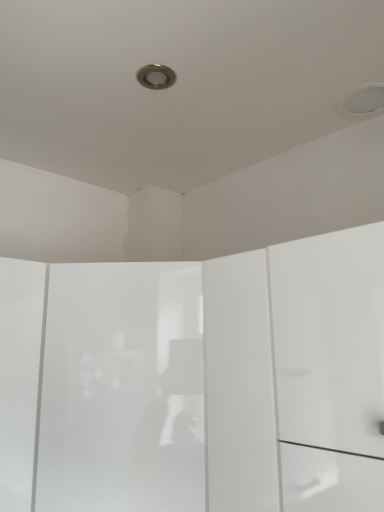
Image resolution: width=384 pixels, height=512 pixels. Find the location of `transparent glossy screen door at center`. transparent glossy screen door at center is located at coordinates click(x=122, y=389).

Describe the element at coordinates (122, 389) in the screenshot. Image resolution: width=384 pixels, height=512 pixels. I see `transparent glossy screen door at center` at that location.

You are a GUI agent. You are given a task and a screenshot of the screen. Output one action in this format:
    pyautogui.click(x=<x>, y=<y>)
    Task: Click on the transparent glossy screen door at center
    The image size is (384, 512).
    Given the screenshot: What is the action you would take?
    pyautogui.click(x=122, y=389)